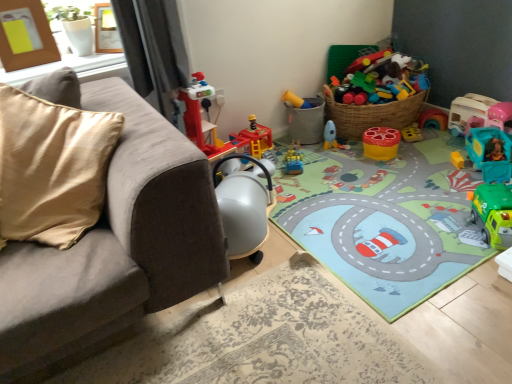
The width and height of the screenshot is (512, 384). I want to click on vacant space behind teal plastic toy car at right, placed as the fifth toy when sorted from left to right, so click(x=439, y=143).